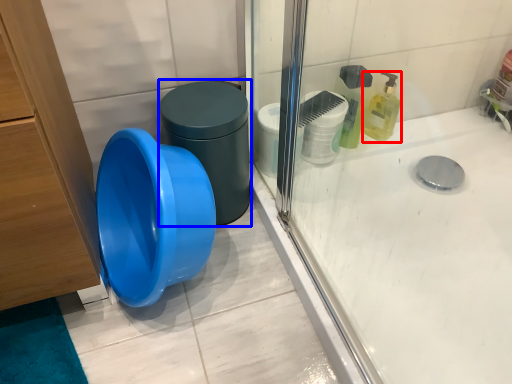
Question: Among these objects, which one is farthest to the camera, cleaning product (highlighted by a red box) or potty (highlighted by a blue box)?

Choices:
 (A) cleaning product
 (B) potty

Answer: (A)